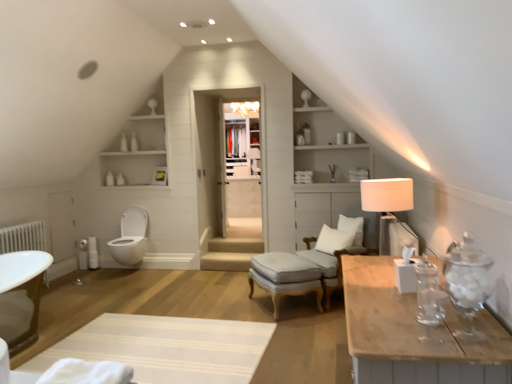
Find the location of a particular element. This screenshot has height=384, width=512. free point in front of light gray fabric stool at center is located at coordinates (293, 327).